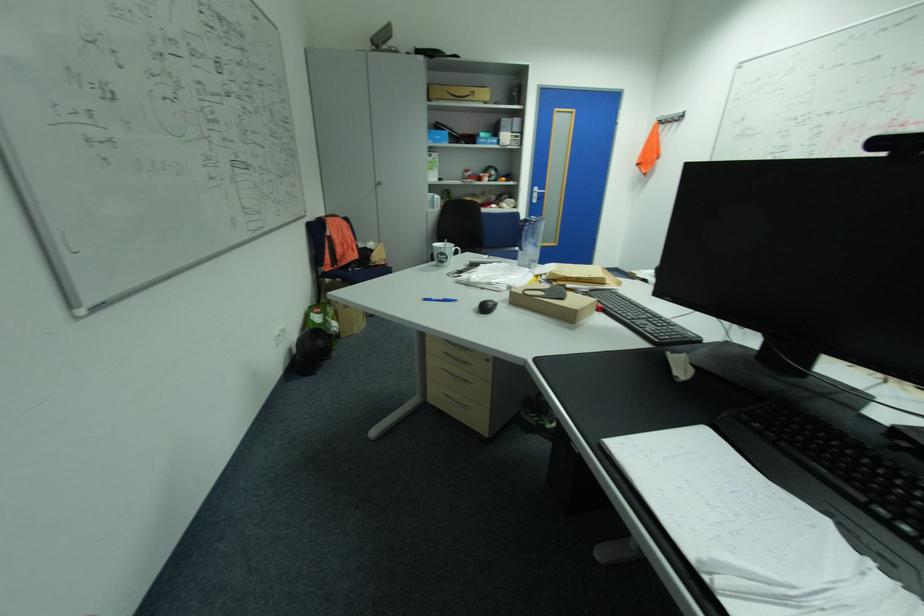
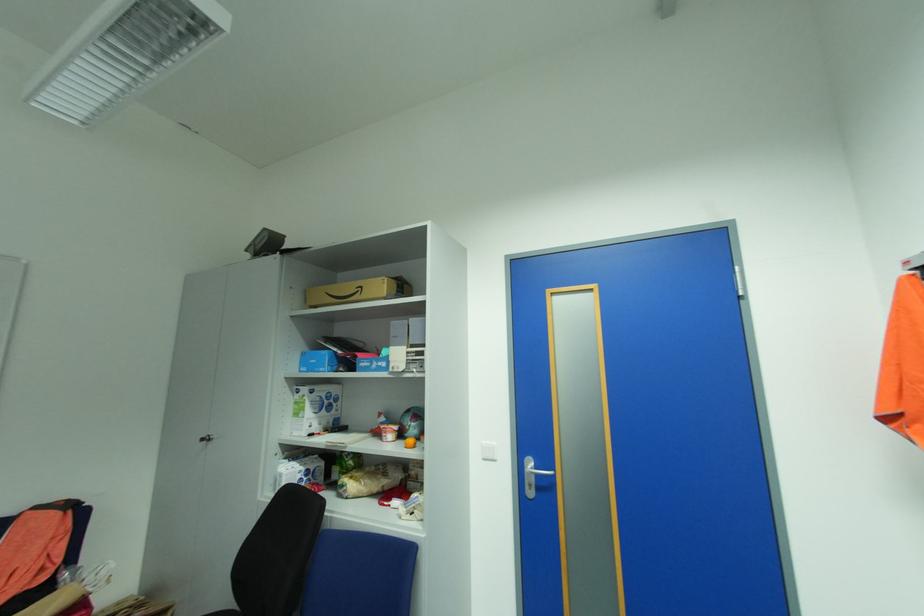
Where in the second image is the point corresponding to the point at 544,193 from the first image?

(543, 475)